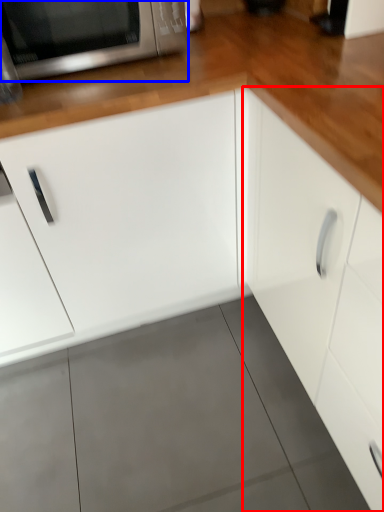
Question: Which of the following is the closest to the observer, cabinetry (highlighted by a red box) or microwave oven (highlighted by a blue box)?

Choices:
 (A) cabinetry
 (B) microwave oven

Answer: (A)